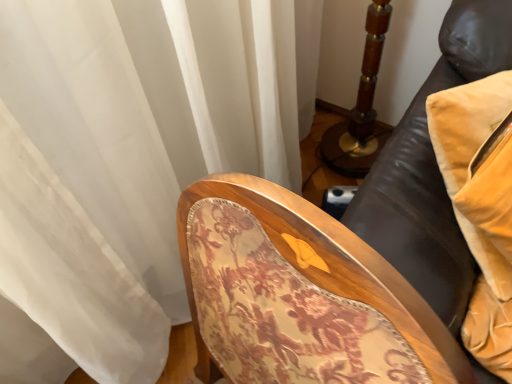
Question: Is velvet yellow pillow at right wider or thinner than floral fabric chair at center?

Choices:
 (A) wide
 (B) thin

Answer: (B)

Question: Considering the positions of velvet yellow pillow at right and floral fabric chair at center in the image, is velvet yellow pillow at right taller or shorter than floral fabric chair at center?

Choices:
 (A) short
 (B) tall

Answer: (A)

Question: Would you say velvet yellow pillow at right is to the left or to the right of floral fabric chair at center in the picture?

Choices:
 (A) right
 (B) left

Answer: (A)

Question: Considering the positions of floral fabric chair at center and velvet yellow pillow at right in the image, is floral fabric chair at center bigger or smaller than velvet yellow pillow at right?

Choices:
 (A) small
 (B) big

Answer: (B)

Question: In the image, is floral fabric chair at center positioned in front of or behind velvet yellow pillow at right?

Choices:
 (A) behind
 (B) front

Answer: (B)

Question: Is floral fabric chair at center taller or shorter than velvet yellow pillow at right?

Choices:
 (A) short
 (B) tall

Answer: (B)

Question: In the image, is floral fabric chair at center on the left side or the right side of velvet yellow pillow at right?

Choices:
 (A) right
 (B) left

Answer: (B)